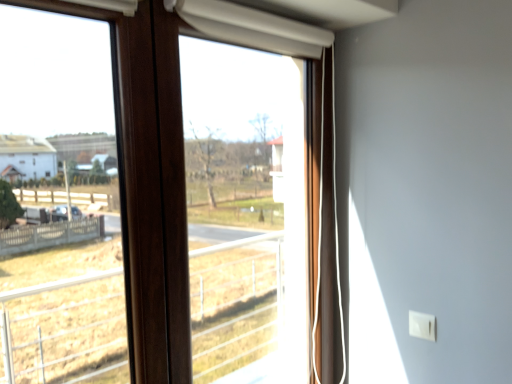
The height and width of the screenshot is (384, 512). Identify the location of wooden frame at center. (165, 157).

The height and width of the screenshot is (384, 512). Describe the element at coordinates (165, 157) in the screenshot. I see `wooden frame at center` at that location.

The height and width of the screenshot is (384, 512). In order to click on transparent plastic window screen at center in this screenshot , I will do pos(245,213).

Image resolution: width=512 pixels, height=384 pixels. What do you see at coordinates (245, 213) in the screenshot?
I see `transparent plastic window screen at center` at bounding box center [245, 213].

Locate an element on the screen. Image resolution: width=512 pixels, height=384 pixels. wooden frame at center is located at coordinates (165, 157).

Which object is positioned more to the left, wooden frame at center or transparent plastic window screen at center?

From the viewer's perspective, wooden frame at center appears more on the left side.

Considering their positions, is wooden frame at center located in front of or behind transparent plastic window screen at center?

wooden frame at center is in front of transparent plastic window screen at center.

Considering the points (142, 22) and (222, 222), which point is in front, point (142, 22) or point (222, 222)?

The point (142, 22) is closer to the camera.

From the image's perspective, is wooden frame at center located above or below transparent plastic window screen at center?

Based on their image positions, wooden frame at center is located beneath transparent plastic window screen at center.

From a real-world perspective, is wooden frame at center on transparent plastic window screen at center?

Yes, from a real-world perspective, wooden frame at center is on top of transparent plastic window screen at center.

Considering the relative sizes of wooden frame at center and transparent plastic window screen at center in the image provided, is wooden frame at center wider than transparent plastic window screen at center?

Correct, the width of wooden frame at center exceeds that of transparent plastic window screen at center.

Considering the sizes of wooden frame at center and transparent plastic window screen at center in the image, is wooden frame at center taller or shorter than transparent plastic window screen at center?

In the image, wooden frame at center appears to be taller than transparent plastic window screen at center.

In terms of size, does wooden frame at center appear bigger or smaller than transparent plastic window screen at center?

In the image, wooden frame at center appears to be larger than transparent plastic window screen at center.

Is wooden frame at center positioned beyond the bounds of transparent plastic window screen at center?

Actually, wooden frame at center is within transparent plastic window screen at center.

Are wooden frame at center and transparent plastic window screen at center located far from each other?

That's not correct — wooden frame at center is a little close to transparent plastic window screen at center.

Is wooden frame at center turned away from transparent plastic window screen at center?

Yes, wooden frame at center's orientation is away from transparent plastic window screen at center.

Can you tell me how much wooden frame at center and transparent plastic window screen at center differ in facing direction?

0.00578 degrees.

Identify the location of window in front of the transparent plastic window screen at center. (165, 157).

Is transparent plastic window screen at center at the right side of wooden frame at center?

Correct, you'll find transparent plastic window screen at center to the right of wooden frame at center.

Considering the positions of objects transparent plastic window screen at center and wooden frame at center in the image provided, who is behind, transparent plastic window screen at center or wooden frame at center?

transparent plastic window screen at center is further away from the camera.

Considering the points (267, 320) and (187, 311), which point is behind, point (267, 320) or point (187, 311)?

The point (267, 320) is more distant.

From the image's perspective, is transparent plastic window screen at center located beneath wooden frame at center?

No.

From a real-world perspective, relative to wooden frame at center, is transparent plastic window screen at center vertically above or below?

Clearly, from a real-world perspective, transparent plastic window screen at center is below wooden frame at center.

Which object is wider, transparent plastic window screen at center or wooden frame at center?

wooden frame at center is wider.

Can you confirm if transparent plastic window screen at center is shorter than wooden frame at center?

Correct, transparent plastic window screen at center is not as tall as wooden frame at center.

Considering the sizes of objects transparent plastic window screen at center and wooden frame at center in the image provided, who is smaller, transparent plastic window screen at center or wooden frame at center?

transparent plastic window screen at center.

Is transparent plastic window screen at center not inside wooden frame at center?

No, transparent plastic window screen at center is inside wooden frame at center's boundary.

Is there a large distance between transparent plastic window screen at center and wooden frame at center?

No, transparent plastic window screen at center is in close proximity to wooden frame at center.

Is transparent plastic window screen at center oriented towards wooden frame at center?

Yes, transparent plastic window screen at center is facing wooden frame at center.

How different are the orientations of transparent plastic window screen at center and wooden frame at center in degrees?

The angle between the facing direction of transparent plastic window screen at center and the facing direction of wooden frame at center is 0.00578 degrees.

You are a GUI agent. You are given a task and a screenshot of the screen. Output one action in this format:
    pyautogui.click(x=<x>, y=<y>)
    Task: Click on the window in front of the transparent plastic window screen at center
    
    Given the screenshot: What is the action you would take?
    pyautogui.click(x=165, y=157)

Locate an element on the screen. window in front of the transparent plastic window screen at center is located at coordinates (165, 157).

The image size is (512, 384). What are the coordinates of `window screen that is behind the wooden frame at center` in the screenshot? It's located at (245, 213).